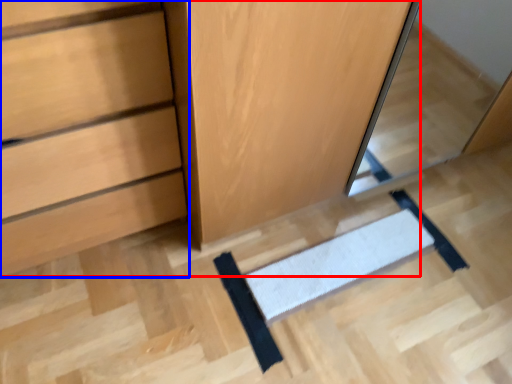
Question: Which object is closer to the camera taking this photo, dresser (highlighted by a red box) or chest of drawers (highlighted by a blue box)?

Choices:
 (A) dresser
 (B) chest of drawers

Answer: (B)